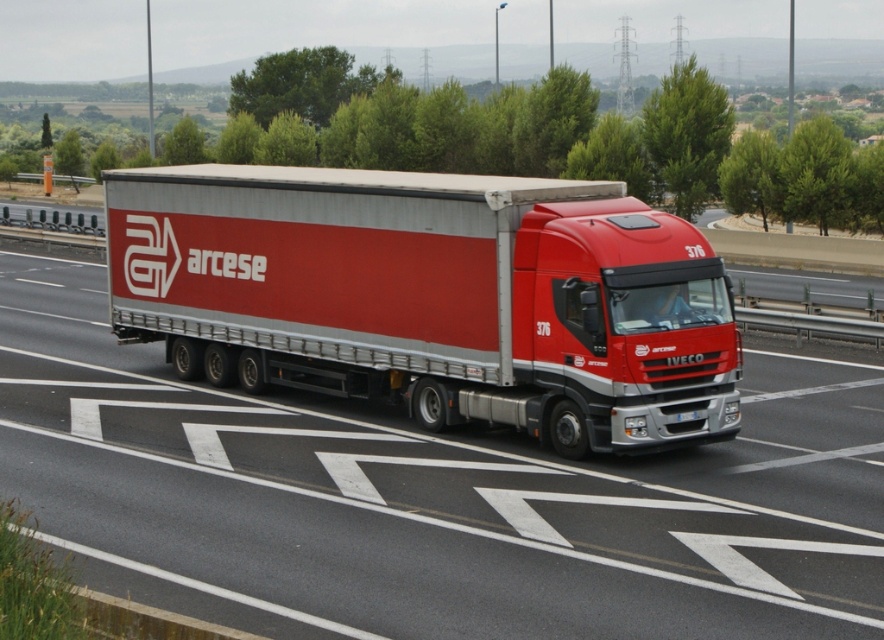
You are a traffic officer observing a red Iveco truck with a silver trailer on a highway. The truck has the number 376 on its cab and is driving in the lane with white lane dividers. There is a point at coordinates (x=431, y=499) in the image. Which object does this point correspond to?

The point at coordinates (x=431, y=499) corresponds to the red matte truck at center.

You are a photographer trying to capture the red Iveco truck with its silver trailer on the highway. You notice two points marked on your camera screen at coordinates point (328, 556) and point (705, 330). Which point should you focus on if you want to get a clearer image of the truck closer to the camera?

You should focus on point (328, 556) because it is closer to the camera than point (705, 330), making it easier to capture a clearer image of the truck closer to the camera.